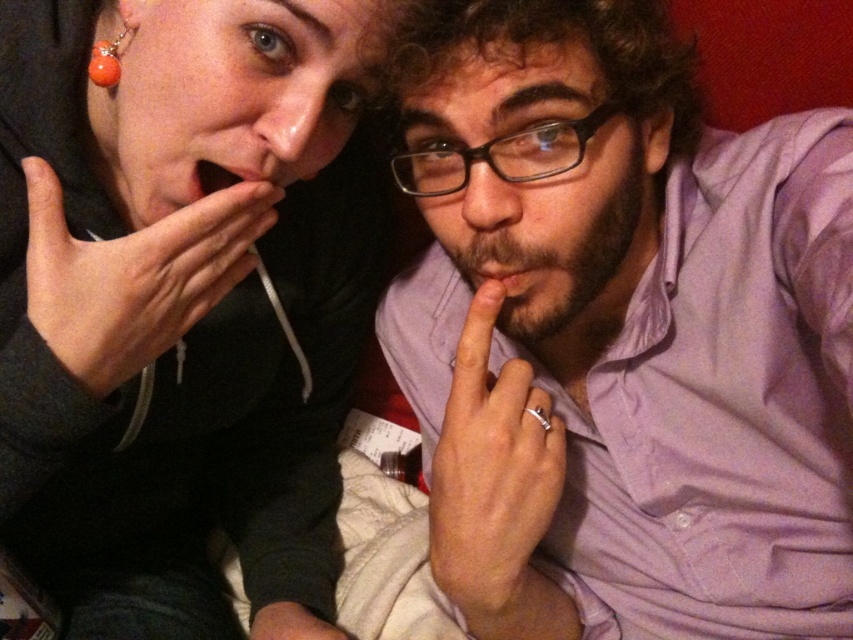
This screenshot has height=640, width=853. I want to click on silver metallic ring at center, so click(x=494, y=481).

In the scene shown: Between silver metallic ring at center and matte black hand at lower center, which one has more height?

silver metallic ring at center is taller.

The height and width of the screenshot is (640, 853). I want to click on silver metallic ring at center, so click(494, 481).

Can you confirm if silver metallic ring at center is positioned below orange glass bead at upper left?

Indeed, silver metallic ring at center is positioned under orange glass bead at upper left.

Does point (431, 476) come behind point (97, 64)?

Yes.

The height and width of the screenshot is (640, 853). I want to click on silver metallic ring at center, so click(494, 481).

Can you confirm if matte black hoodie at upper left is thinner than matte black hand at upper left?

Incorrect, matte black hoodie at upper left's width is not less than matte black hand at upper left's.

Who is more distant from viewer, (x=143, y=102) or (x=213, y=218)?

The point (x=143, y=102) is more distant.

Identify the location of matte black hoodie at upper left. The image size is (853, 640). (183, 300).